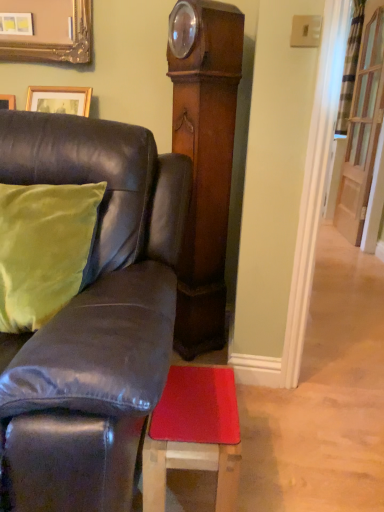
The image size is (384, 512). Find the location of `vacant space situated above rubberized red mat at lower center (from a real-world perspective)`. vacant space situated above rubberized red mat at lower center (from a real-world perspective) is located at coordinates (193, 404).